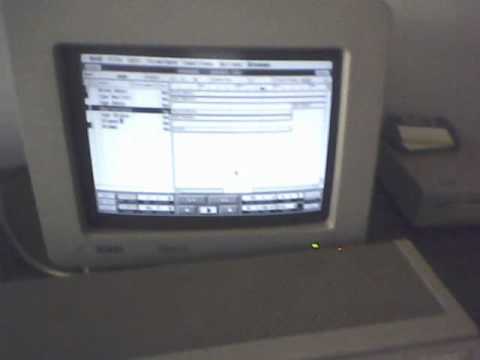
You are a GUI agent. You are given a task and a screenshot of the screen. Output one action in this format:
    pyautogui.click(x=<x>, y=<y>)
    Task: Click on the right center edge of monitor
    Image resolution: width=480 pixels, height=360 pixels.
    Given the screenshot: What is the action you would take?
    pyautogui.click(x=362, y=144)